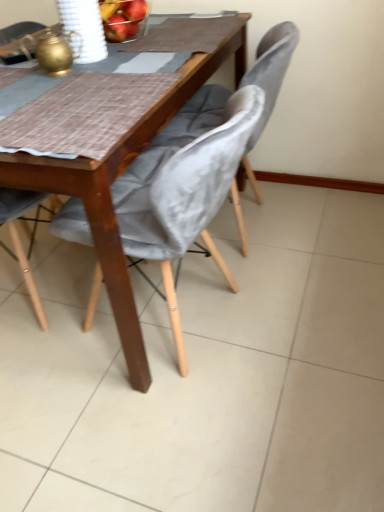
I want to click on free space above velvet grey chair at center, which is the second chair in right-to-left order (from a real-world perspective), so [107, 92].